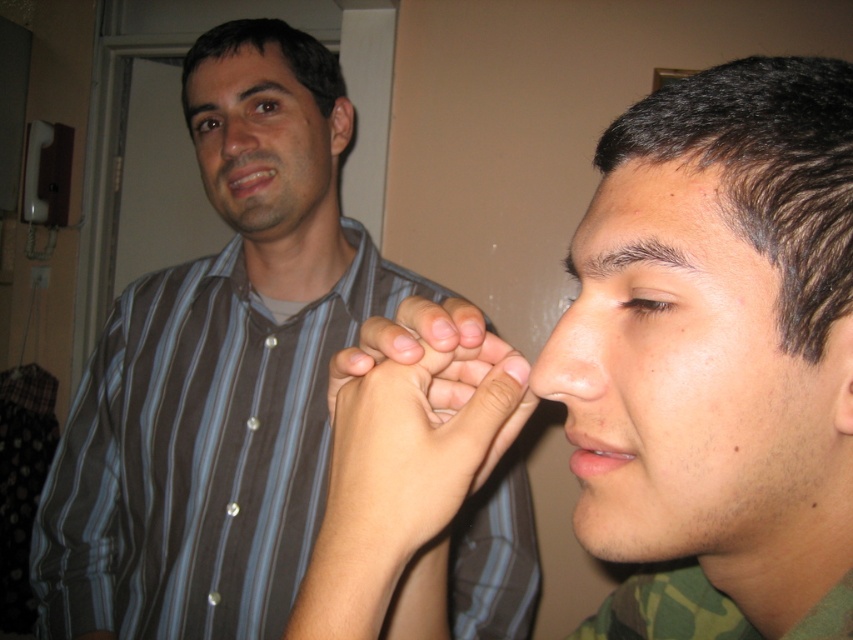
Between matte striped shirt at center and smooth skin face at right, which one has more height?

With more height is matte striped shirt at center.

Where is `matte striped shirt at center`? The width and height of the screenshot is (853, 640). matte striped shirt at center is located at coordinates (723, 355).

Image resolution: width=853 pixels, height=640 pixels. I want to click on matte striped shirt at center, so (x=723, y=355).

Which of these two, striped cotton shirt at left or matte brown shirt at upper left, stands shorter?

matte brown shirt at upper left is shorter.

Between striped cotton shirt at left and matte brown shirt at upper left, which one appears on the left side from the viewer's perspective?

From the viewer's perspective, striped cotton shirt at left appears more on the left side.

Where is `striped cotton shirt at left`? striped cotton shirt at left is located at coordinates (218, 384).

Between smooth skin face at right and smooth skin nose at center, which one is positioned lower?

smooth skin face at right is lower down.

Does point (728, 435) come behind point (560, 376)?

No.

Locate an element on the screen. smooth skin face at right is located at coordinates (694, 387).